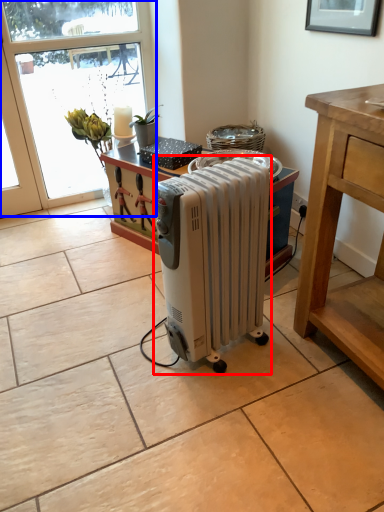
Question: Which object is further to the camera taking this photo, home appliance (highlighted by a red box) or window (highlighted by a blue box)?

Choices:
 (A) home appliance
 (B) window

Answer: (B)